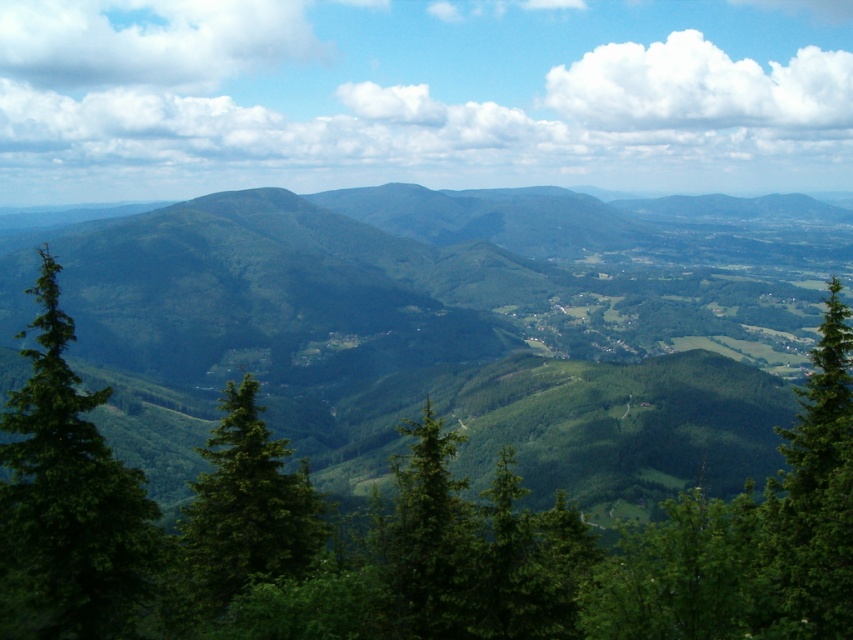
Question: From the image, what is the correct spatial relationship of green matte forest at center in relation to green leafy tree at center?

Choices:
 (A) below
 (B) above

Answer: (B)

Question: Which object is closer to the camera taking this photo?

Choices:
 (A) green leafy tree at center
 (B) green matte tree at left
 (C) green matte forest at center
 (D) green textured tree at right

Answer: (B)

Question: Is green matte forest at center closer to camera compared to green leafy tree at center?

Choices:
 (A) yes
 (B) no

Answer: (B)

Question: Can you confirm if green matte forest at center is thinner than green matte tree at left?

Choices:
 (A) yes
 (B) no

Answer: (B)

Question: Among these objects, which one is farthest from the camera?

Choices:
 (A) green textured tree at right
 (B) green matte forest at center
 (C) green leafy tree at center
 (D) green matte tree at left

Answer: (B)

Question: Which point is closer to the camera?

Choices:
 (A) green matte tree at center
 (B) green leafy tree at center
 (C) green matte tree at left

Answer: (C)